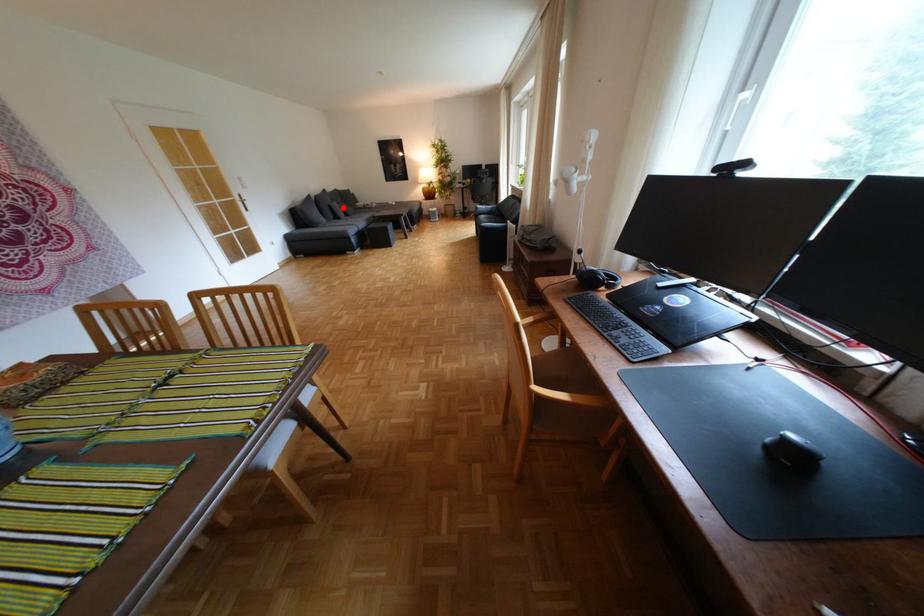
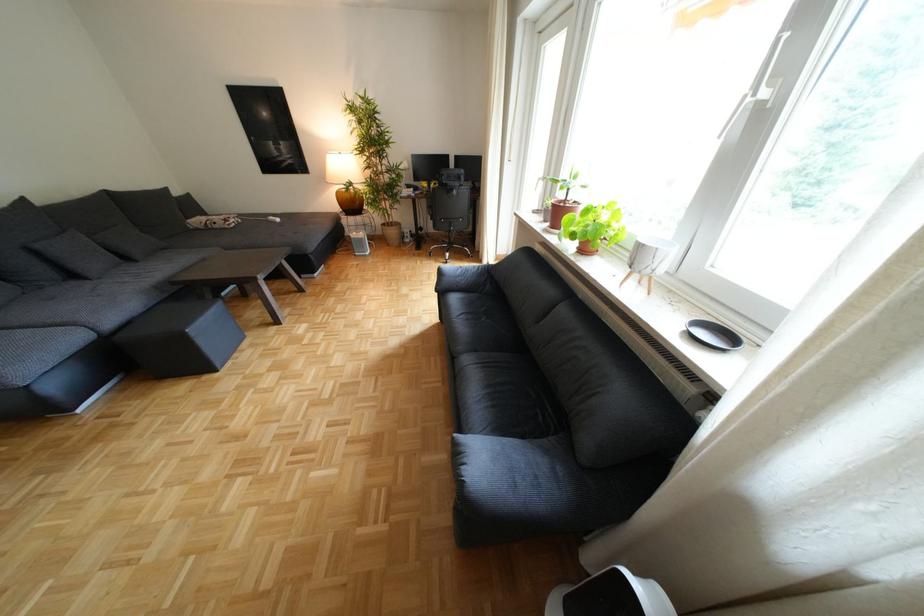
The point at the highlighted location is marked in the first image. Where is the corresponding point in the second image?

(49, 253)